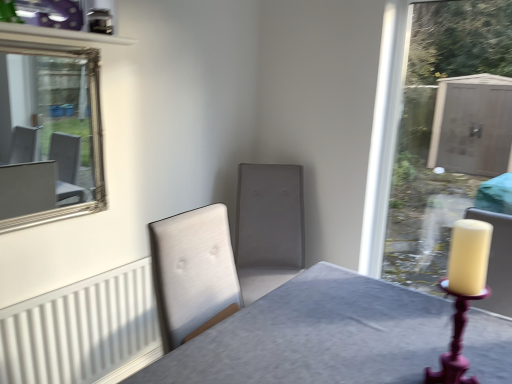
Question: Is white ribbed radiator at lower left in front of or behind matte purple candle holder at right in the image?

Choices:
 (A) front
 (B) behind

Answer: (B)

Question: Is white ribbed radiator at lower left to the left or to the right of matte purple candle holder at right in the image?

Choices:
 (A) left
 (B) right

Answer: (A)

Question: Which of these objects is positioned closest to the matte purple candle holder at right?

Choices:
 (A) matte gray swivel chair at center
 (B) white ribbed radiator at lower left
 (C) silver/glass mirror at upper left

Answer: (A)

Question: Which object is the farthest from the matte purple candle holder at right?

Choices:
 (A) silver/glass mirror at upper left
 (B) white ribbed radiator at lower left
 (C) matte gray swivel chair at center

Answer: (A)